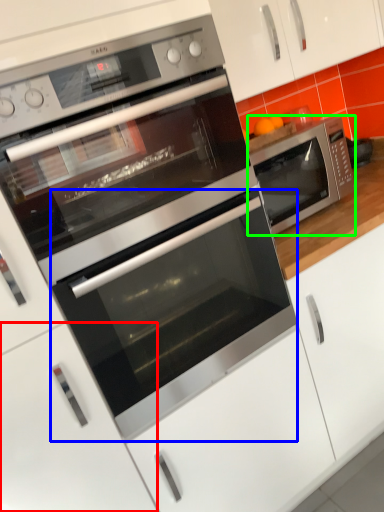
Question: Which object is positioned closest to drawer (highlighted by a red box)? Select from oven (highlighted by a blue box) and microwave oven (highlighted by a green box).

Choices:
 (A) oven
 (B) microwave oven

Answer: (A)